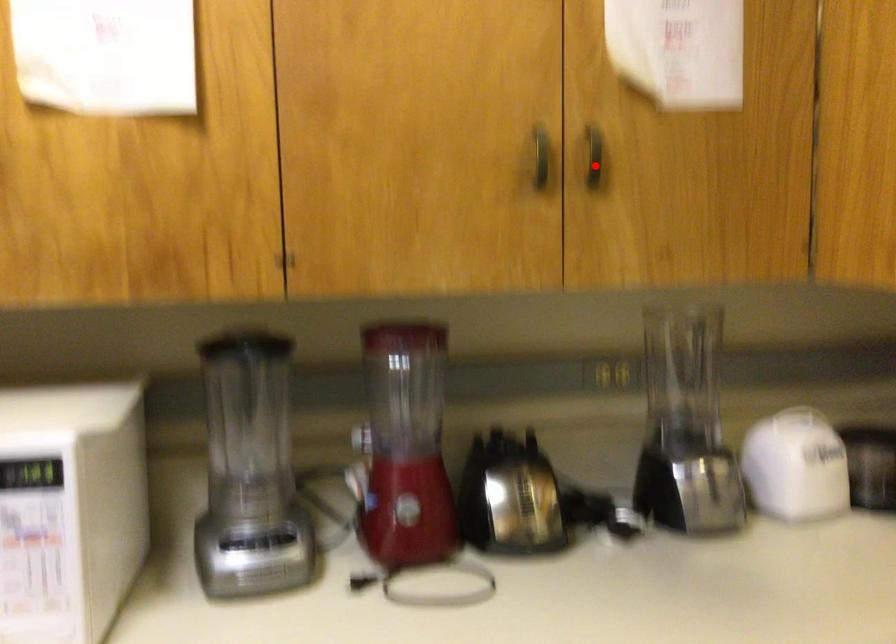
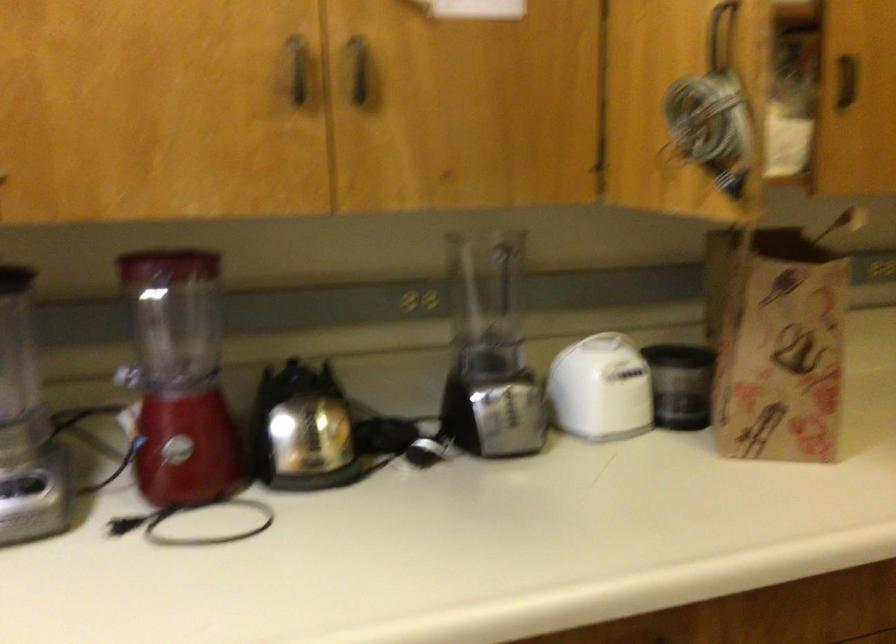
Where in the second image is the point corresponding to the highlighted location from the first image?

(359, 69)